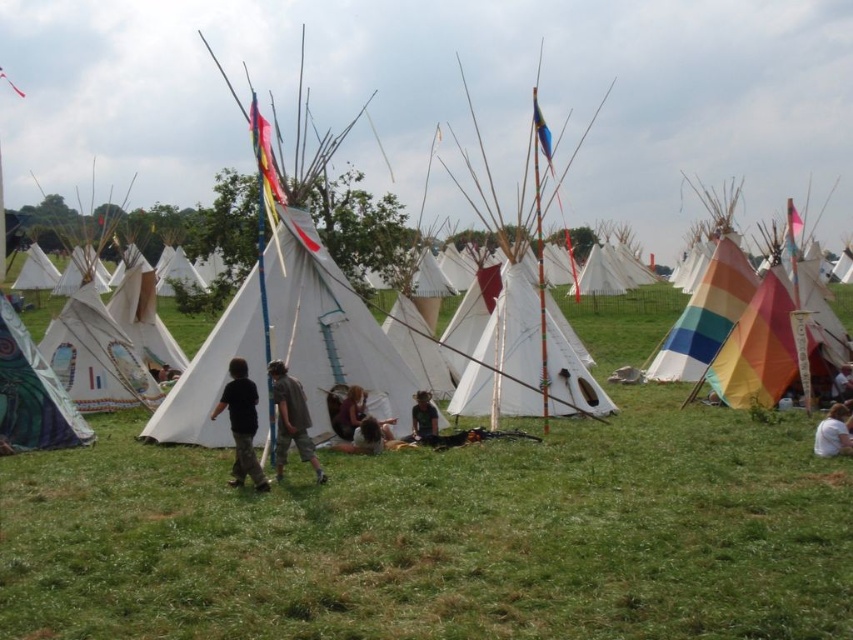
Between white cotton shirt at lower right and dark green fabric at center, which one has more height?

dark green fabric at center is taller.

Which is more to the right, white cotton shirt at lower right or dark green fabric at center?

white cotton shirt at lower right

Which is behind, point (817, 452) or point (421, 401)?

Point (421, 401)

Find the location of a particular element. white cotton shirt at lower right is located at coordinates (833, 433).

Is green fabric tent at lower left positioned before black cotton shirt at center?

No, green fabric tent at lower left is further to the viewer.

Is green fabric tent at lower left further to camera compared to black cotton shirt at center?

Yes, green fabric tent at lower left is further from the viewer.

Between point (39, 372) and point (251, 474), which one is positioned behind?

Positioned behind is point (39, 372).

Identify the location of green fabric tent at lower left. This screenshot has width=853, height=640. (32, 394).

Does green grass at center have a larger size compared to black cotton shirt at center?

Yes, green grass at center is bigger than black cotton shirt at center.

Can you confirm if green grass at center is positioned to the right of black cotton shirt at center?

Correct, you'll find green grass at center to the right of black cotton shirt at center.

Does point (137, 460) come behind point (236, 387)?

That is True.

Image resolution: width=853 pixels, height=640 pixels. I want to click on green grass at center, so click(x=440, y=536).